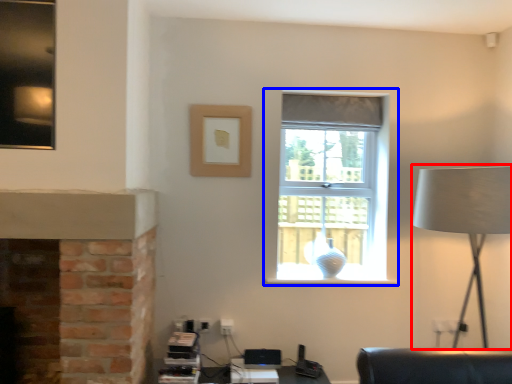
Question: Which object is closer to the camera taking this photo, table lamp (highlighted by a red box) or window (highlighted by a blue box)?

Choices:
 (A) table lamp
 (B) window

Answer: (A)